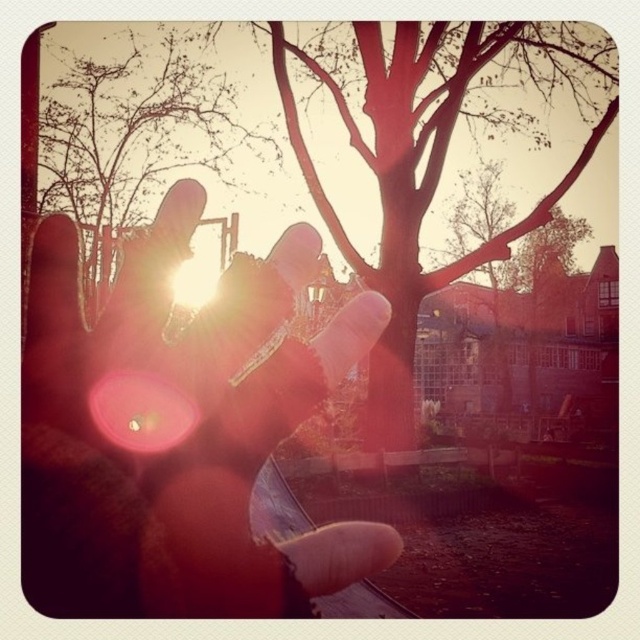
Question: Which point is closer to the camera?

Choices:
 (A) translucent skin at center
 (B) smooth bark tree at center
 (C) brown matte tree at upper center

Answer: (A)

Question: Among these points, which one is farthest from the camera?

Choices:
 (A) (170, 516)
 (B) (339, 221)

Answer: (B)

Question: In this image, where is smooth bark tree at center located relative to brown matte tree at upper center?

Choices:
 (A) above
 (B) below

Answer: (B)

Question: Can you confirm if smooth bark tree at center is positioned above brown matte tree at upper center?

Choices:
 (A) no
 (B) yes

Answer: (A)

Question: Does smooth bark tree at center appear on the left side of brown matte tree at upper center?

Choices:
 (A) no
 (B) yes

Answer: (A)

Question: Which object is closer to the camera taking this photo?

Choices:
 (A) brown matte tree at upper center
 (B) smooth bark tree at center
 (C) translucent skin at center

Answer: (C)